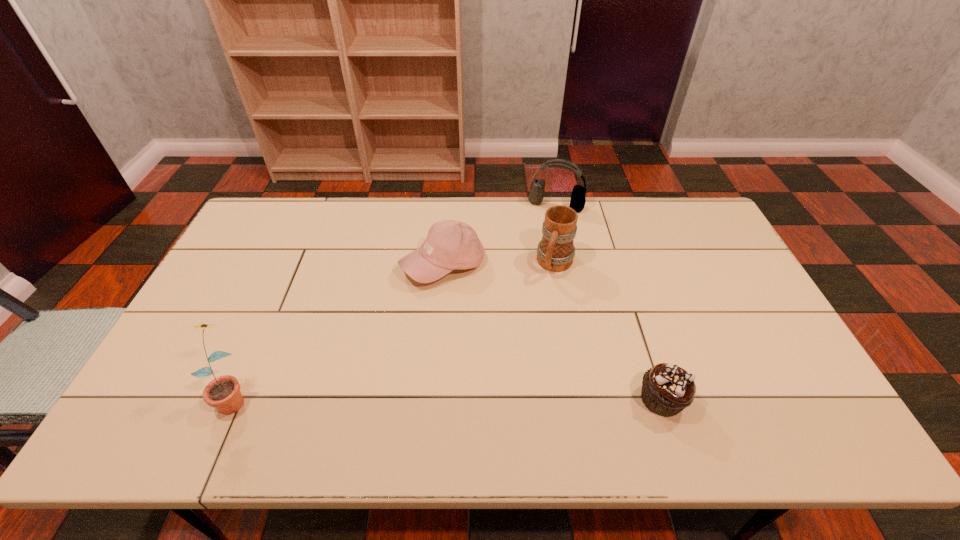
Find the location of a particular element. Image resolution: width=960 pixels, height=540 pixels. free area in between the sunflower and the second shortest object is located at coordinates (339, 330).

You are a GUI agent. You are given a task and a screenshot of the screen. Output one action in this format:
    pyautogui.click(x=<x>, y=<y>)
    Task: Click on the free space between the baseball cap and the leftmost object
    The height and width of the screenshot is (540, 960).
    Given the screenshot: What is the action you would take?
    pyautogui.click(x=339, y=330)

In order to click on free area in between the fourth tallest object and the cupcake in this screenshot , I will do `click(552, 332)`.

This screenshot has width=960, height=540. Find the location of `vacant space that is in between the tallest object and the farthest object`. vacant space that is in between the tallest object and the farthest object is located at coordinates (396, 300).

At what (x,y) coordinates should I click in order to perform the action: click on object that is the second nearest to the shortest object. Please return your answer as a coordinate pair (x, y). Looking at the image, I should click on (450, 245).

Image resolution: width=960 pixels, height=540 pixels. I want to click on the second closest object to the farthest object, so click(450, 245).

The height and width of the screenshot is (540, 960). Find the location of `free location that satisfies the following two spatial constraints: 1. on the front side of the shortest object; 2. on the right side of the mug`. free location that satisfies the following two spatial constraints: 1. on the front side of the shortest object; 2. on the right side of the mug is located at coordinates (579, 400).

Image resolution: width=960 pixels, height=540 pixels. Find the location of `free region that satisfies the following two spatial constraints: 1. on the flower of the cupcake; 2. on the right side of the leftmost object`. free region that satisfies the following two spatial constraints: 1. on the flower of the cupcake; 2. on the right side of the leftmost object is located at coordinates (233, 400).